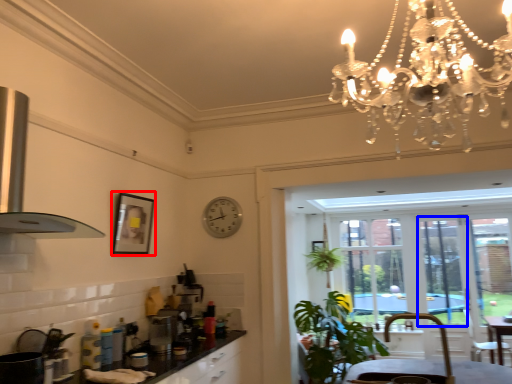
Question: Which object is closer to the camera taking this photo, picture frame (highlighted by a red box) or window screen (highlighted by a blue box)?

Choices:
 (A) picture frame
 (B) window screen

Answer: (A)